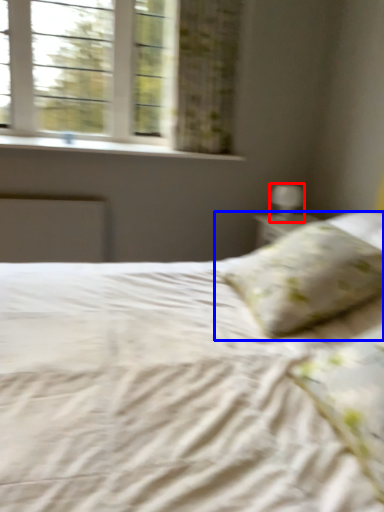
Question: Which object appears farthest to the camera in this image, table lamp (highlighted by a red box) or pillow (highlighted by a blue box)?

Choices:
 (A) table lamp
 (B) pillow

Answer: (A)